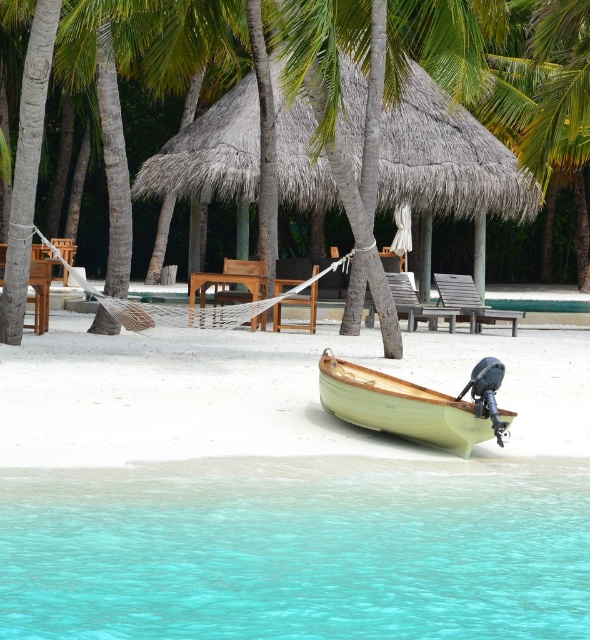
Is thatched roof hut at center taller than light wood motorboat at lower center?

Correct, thatched roof hut at center is much taller as light wood motorboat at lower center.

What do you see at coordinates (447, 160) in the screenshot? I see `thatched roof hut at center` at bounding box center [447, 160].

Is point (222, 136) farther from camera compared to point (352, 410)?

That is True.

In order to click on thatched roof hut at center in this screenshot , I will do `click(447, 160)`.

Measure the distance from light wood boat at center to wooden textured beach chair at center.

light wood boat at center and wooden textured beach chair at center are 5.87 meters apart from each other.

Does light wood boat at center appear under wooden textured beach chair at center?

Yes.

Describe the element at coordinates (261, 392) in the screenshot. The width and height of the screenshot is (590, 640). I see `light wood boat at center` at that location.

This screenshot has height=640, width=590. What are the coordinates of `light wood boat at center` in the screenshot? It's located at (261, 392).

Is light wood motorboat at lower center positioned before wooden textured beach chair at center?

Yes.

Can you confirm if light wood motorboat at lower center is positioned below wooden textured beach chair at center?

Indeed, light wood motorboat at lower center is positioned under wooden textured beach chair at center.

This screenshot has width=590, height=640. Find the location of `light wood motorboat at lower center`. light wood motorboat at lower center is located at coordinates (398, 404).